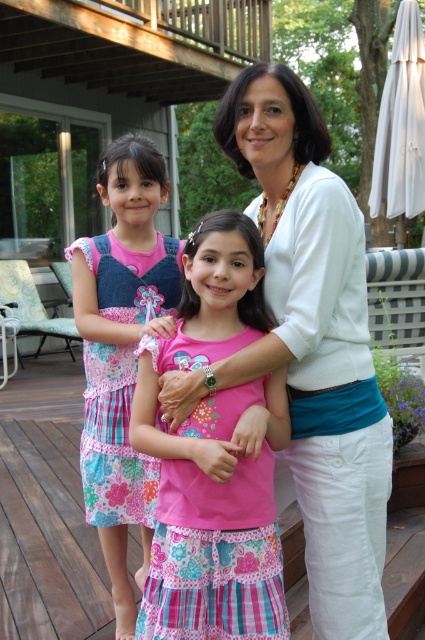
You are standing in front of the wooden deck scene. There are two points marked in the image. The first point is at coordinates point (235, 292) and the second is at point (119, 371). Which point is nearer to you?

Point (235, 292) is closer to the viewer than point (119, 371).

You are a photographer trying to capture a group photo of the two girls wearing the pink fabric dress at center and the floral cotton dress at center. Which girl should you ask to stand back so that both are visible in the frame?

The pink fabric dress at center is much taller than the floral cotton dress at center, so you should ask the girl wearing the pink fabric dress at center to stand back so that both are visible in the frame.